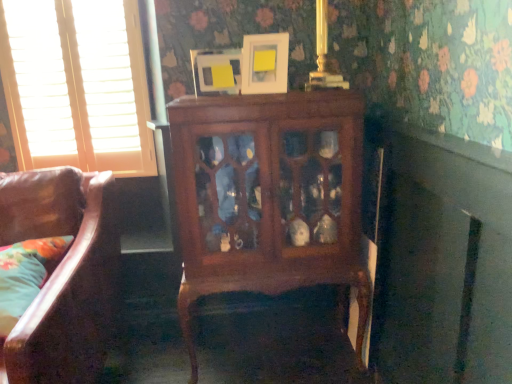
Question: Is mahogany cabinet at center further to the viewer compared to fluffy fabric pillow at lower left?

Choices:
 (A) yes
 (B) no

Answer: (A)

Question: Considering the relative sizes of mahogany cabinet at center and fluffy fabric pillow at lower left in the image provided, is mahogany cabinet at center bigger than fluffy fabric pillow at lower left?

Choices:
 (A) yes
 (B) no

Answer: (A)

Question: Is mahogany cabinet at center thinner than fluffy fabric pillow at lower left?

Choices:
 (A) yes
 (B) no

Answer: (A)

Question: Are mahogany cabinet at center and fluffy fabric pillow at lower left located far from each other?

Choices:
 (A) yes
 (B) no

Answer: (B)

Question: Is mahogany cabinet at center looking in the opposite direction of fluffy fabric pillow at lower left?

Choices:
 (A) no
 (B) yes

Answer: (A)

Question: Is fluffy fabric pillow at lower left inside or outside of mahogany cabinet at center?

Choices:
 (A) inside
 (B) outside

Answer: (B)

Question: Based on their positions, is fluffy fabric pillow at lower left located to the left or right of mahogany cabinet at center?

Choices:
 (A) right
 (B) left

Answer: (B)

Question: Considering the positions of fluffy fabric pillow at lower left and mahogany cabinet at center in the image, is fluffy fabric pillow at lower left taller or shorter than mahogany cabinet at center?

Choices:
 (A) short
 (B) tall

Answer: (A)

Question: Looking at their shapes, would you say fluffy fabric pillow at lower left is wider or thinner than mahogany cabinet at center?

Choices:
 (A) thin
 (B) wide

Answer: (B)

Question: From a real-world perspective, relative to white matte picture frame at upper center, acting as the 2th picture frame starting from the left, is white wood blinds at left vertically above or below?

Choices:
 (A) below
 (B) above

Answer: (A)

Question: Considering the positions of white wood blinds at left and white matte picture frame at upper center, which ranks as the 1th picture frame in right-to-left order, in the image, is white wood blinds at left taller or shorter than white matte picture frame at upper center, which ranks as the 1th picture frame in right-to-left order,?

Choices:
 (A) tall
 (B) short

Answer: (A)

Question: Looking at the image, does white wood blinds at left seem bigger or smaller compared to white matte picture frame at upper center, which ranks as the 1th picture frame in right-to-left order?

Choices:
 (A) big
 (B) small

Answer: (A)

Question: Would you say white wood blinds at left is to the left or to the right of white matte picture frame at upper center, acting as the 2th picture frame starting from the left, in the picture?

Choices:
 (A) left
 (B) right

Answer: (A)

Question: From the image's perspective, is white matte picture frame at upper center, which ranks as the 1th picture frame in right-to-left order, positioned above or below fluffy fabric pillow at lower left?

Choices:
 (A) above
 (B) below

Answer: (A)

Question: In terms of size, does white matte picture frame at upper center, acting as the 2th picture frame starting from the left, appear bigger or smaller than fluffy fabric pillow at lower left?

Choices:
 (A) big
 (B) small

Answer: (B)